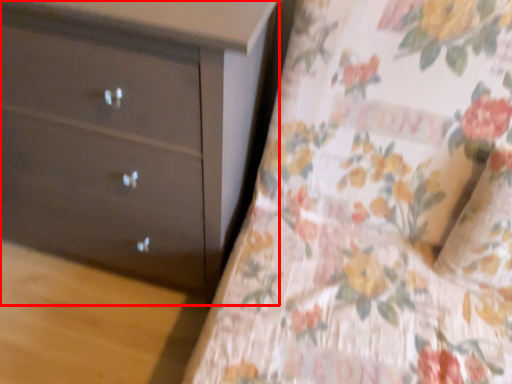
Question: In this image, where is chest of drawers (annotated by the red box) located relative to sheet?

Choices:
 (A) left
 (B) right

Answer: (A)